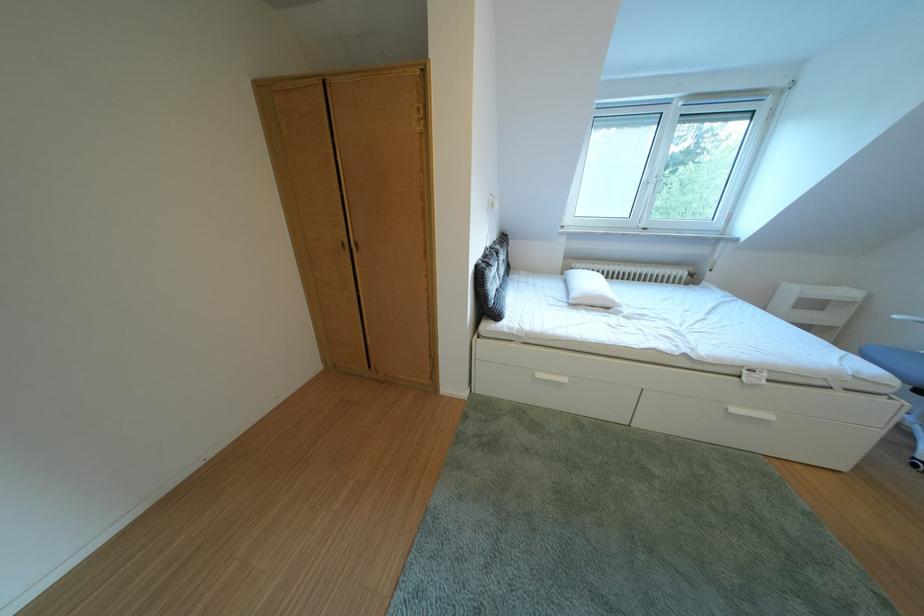
This screenshot has height=616, width=924. Find the location of `window handle`. window handle is located at coordinates (653, 188).